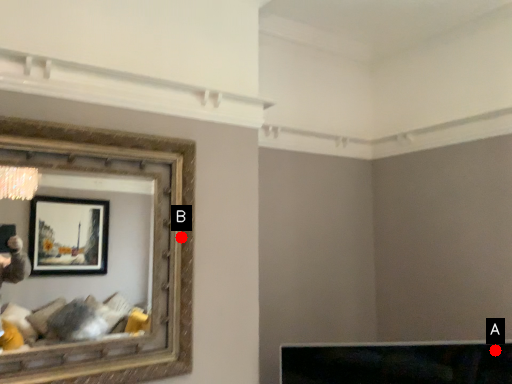
Question: Two points are circled on the image, labeled by A and B beside each circle. Which point is closer to the camera taking this photo?

Choices:
 (A) A is closer
 (B) B is closer

Answer: (B)